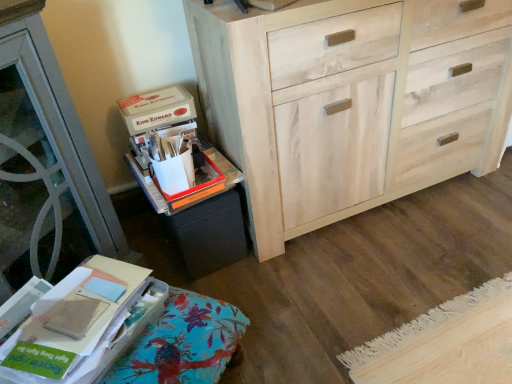
Question: Should I look upward or downward to see matte cardboard box at upper left?

Choices:
 (A) down
 (B) up

Answer: (B)

Question: Should I look upward or downward to see matte cardboard book at lower left?

Choices:
 (A) up
 (B) down

Answer: (B)

Question: Considering the relative sizes of matte cardboard book at lower left and natural wood cabinet at center in the image provided, is matte cardboard book at lower left smaller than natural wood cabinet at center?

Choices:
 (A) no
 (B) yes

Answer: (B)

Question: Could you tell me if matte cardboard book at lower left is turned towards natural wood cabinet at center?

Choices:
 (A) yes
 (B) no

Answer: (B)

Question: Is matte cardboard book at lower left oriented away from natural wood cabinet at center?

Choices:
 (A) yes
 (B) no

Answer: (B)

Question: Is matte cardboard book at lower left wider than natural wood cabinet at center?

Choices:
 (A) no
 (B) yes

Answer: (A)

Question: Is matte cardboard book at lower left next to natural wood cabinet at center and touching it?

Choices:
 (A) yes
 (B) no

Answer: (B)

Question: Can you confirm if matte cardboard book at lower left is positioned to the right of natural wood cabinet at center?

Choices:
 (A) yes
 (B) no

Answer: (B)

Question: Is matte cardboard box at upper left completely or partially outside of black matte storage bin at lower left?

Choices:
 (A) no
 (B) yes

Answer: (B)

Question: Considering the relative positions of matte cardboard box at upper left and black matte storage bin at lower left in the image provided, is matte cardboard box at upper left to the left of black matte storage bin at lower left from the viewer's perspective?

Choices:
 (A) yes
 (B) no

Answer: (A)

Question: Would you say matte cardboard box at upper left is a long distance from black matte storage bin at lower left?

Choices:
 (A) no
 (B) yes

Answer: (A)

Question: Is matte cardboard box at upper left shorter than black matte storage bin at lower left?

Choices:
 (A) yes
 (B) no

Answer: (A)

Question: Is black matte storage bin at lower left located within matte cardboard box at upper left?

Choices:
 (A) yes
 (B) no

Answer: (B)

Question: From a real-world perspective, is matte cardboard box at upper left physically below black matte storage bin at lower left?

Choices:
 (A) no
 (B) yes

Answer: (A)

Question: Is matte cardboard box at upper left thinner than natural wood cabinet at center?

Choices:
 (A) yes
 (B) no

Answer: (A)